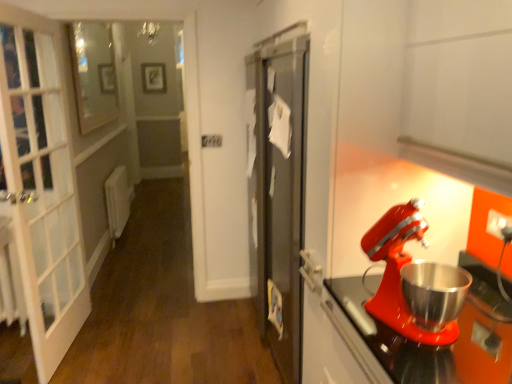
Question: From the image's perspective, relative to matte black picture frame at upper center, is clear glass window at upper left above or below?

Choices:
 (A) below
 (B) above

Answer: (A)

Question: In terms of height, does clear glass window at upper left look taller or shorter compared to matte black picture frame at upper center?

Choices:
 (A) tall
 (B) short

Answer: (A)

Question: Estimate the real-world distances between objects in this image. Which object is farther from the matte red mixer at right?

Choices:
 (A) clear glass window at upper left
 (B) matte black picture frame at upper center

Answer: (B)

Question: Estimate the real-world distances between objects in this image. Which object is closer to the clear glass window at upper left?

Choices:
 (A) matte red mixer at right
 (B) matte black picture frame at upper center

Answer: (B)